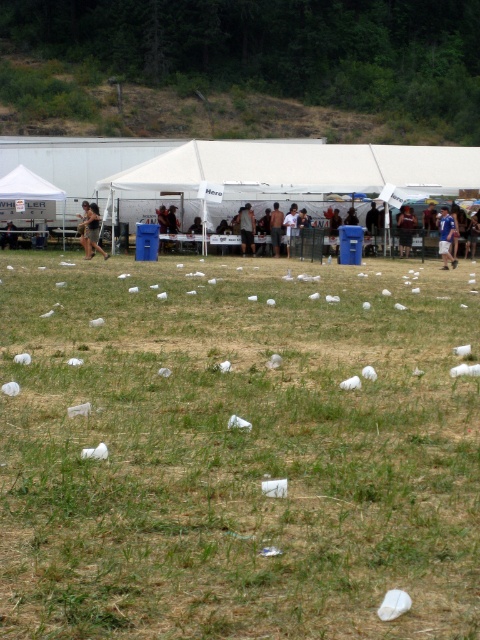
Question: Is blue shirt at center to the left of dark blue shirt at center from the viewer's perspective?

Choices:
 (A) yes
 (B) no

Answer: (B)

Question: Which of the following is the farthest from the observer?

Choices:
 (A) dark blue shirt at center
 (B) dark brown hair at center
 (C) blue shirt at center

Answer: (A)

Question: Considering the relative positions of dark blue shirt at center and dark brown leather jacket at center in the image provided, where is dark blue shirt at center located with respect to dark brown leather jacket at center?

Choices:
 (A) right
 (B) left

Answer: (A)

Question: Which object is positioned closest to the white fabric tent at center?

Choices:
 (A) dark gray shorts at center
 (B) dark brown hair at center
 (C) dark gray shirt at center
 (D) green grass at center

Answer: (C)

Question: Estimate the real-world distances between objects in this image. Which object is farther from the dark gray shirt at center?

Choices:
 (A) white cotton shirt at center
 (B) dark blue shirt at center
 (C) dark brown hair at center

Answer: (C)

Question: Observing the image, what is the correct spatial positioning of dark brown hair at center in reference to dark brown leather jacket at center?

Choices:
 (A) below
 (B) above

Answer: (A)